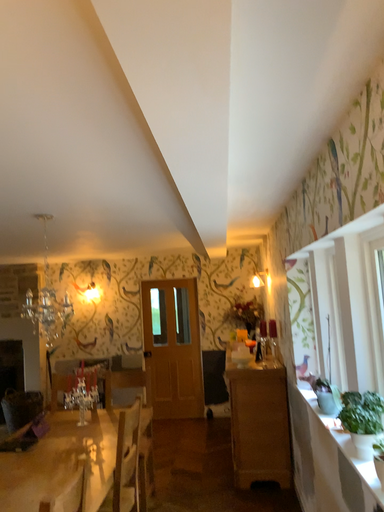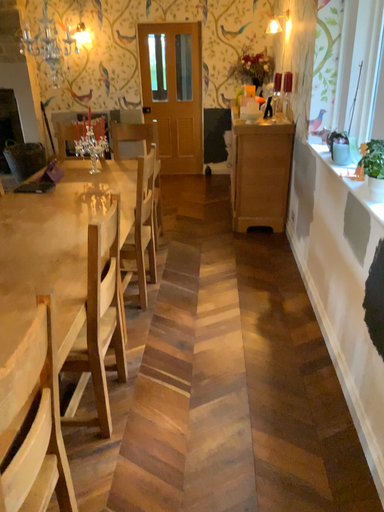
Question: How did the camera likely rotate when shooting the video?

Choices:
 (A) rotated upward
 (B) rotated downward

Answer: (B)